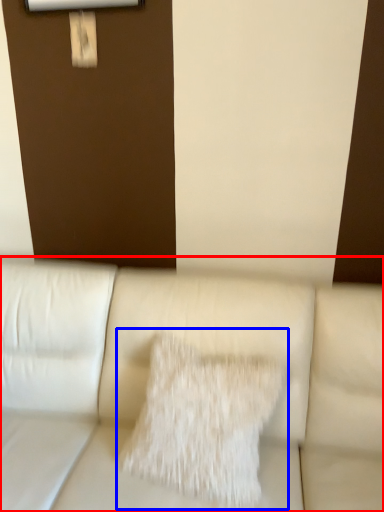
Question: Which object is closer to the camera taking this photo, studio couch (highlighted by a red box) or pillow (highlighted by a blue box)?

Choices:
 (A) studio couch
 (B) pillow

Answer: (A)